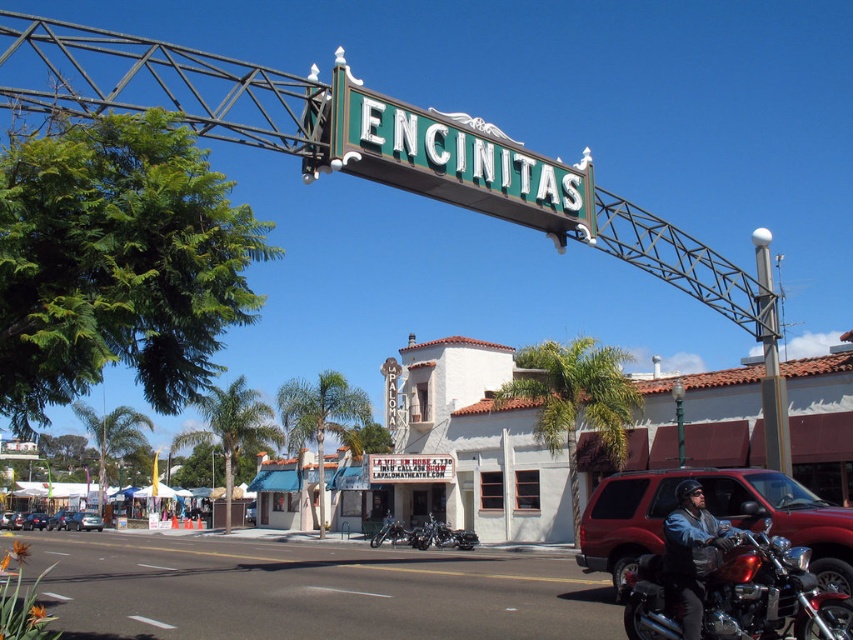
From the picture: You are standing at the center of the street looking towards the large ornate sign. Can you see the shiny chrome motorcycle at lower right from this position?

Yes, since the shiny chrome motorcycle at lower right is located at point (734, 589), which is in the lower right area of the image, you can see it from the center of the street facing the sign.

You are standing at the point marked as point [456,161] in the image. What object is directly in front of you?

The green metallic sign at center is located at point [456,161], so the object directly in front of you is the green metallic sign at center.